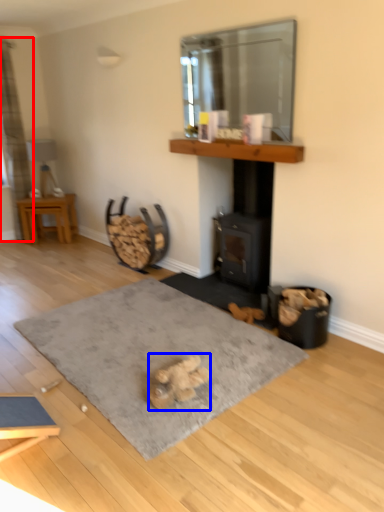
Question: Among these objects, which one is nearest to the camera, curtain (highlighted by a red box) or animal (highlighted by a blue box)?

Choices:
 (A) curtain
 (B) animal

Answer: (B)